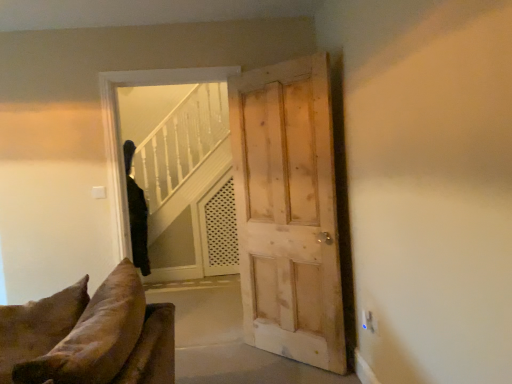
Question: Considering the relative positions of black fabric coat at upper left and transparent glass door at center in the image provided, is black fabric coat at upper left behind transparent glass door at center?

Choices:
 (A) yes
 (B) no

Answer: (A)

Question: Are black fabric coat at upper left and transparent glass door at center far apart?

Choices:
 (A) yes
 (B) no

Answer: (A)

Question: Is black fabric coat at upper left at the left side of transparent glass door at center?

Choices:
 (A) no
 (B) yes

Answer: (B)

Question: From a real-world perspective, is black fabric coat at upper left under transparent glass door at center?

Choices:
 (A) no
 (B) yes

Answer: (B)

Question: Is black fabric coat at upper left with transparent glass door at center?

Choices:
 (A) yes
 (B) no

Answer: (B)

Question: From the image's perspective, is black fabric coat at upper left positioned above or below light brown wooden door at center?

Choices:
 (A) below
 (B) above

Answer: (A)

Question: Is point (143, 236) closer or farther from the camera than point (287, 215)?

Choices:
 (A) closer
 (B) farther

Answer: (B)

Question: Is black fabric coat at upper left inside the boundaries of light brown wooden door at center, or outside?

Choices:
 (A) inside
 (B) outside

Answer: (B)

Question: In the image, is black fabric coat at upper left on the left side or the right side of light brown wooden door at center?

Choices:
 (A) right
 (B) left

Answer: (B)

Question: Considering the positions of black fabric coat at upper left and transparent glass door at center in the image, is black fabric coat at upper left wider or thinner than transparent glass door at center?

Choices:
 (A) wide
 (B) thin

Answer: (A)

Question: From the image's perspective, is black fabric coat at upper left above or below transparent glass door at center?

Choices:
 (A) below
 (B) above

Answer: (A)

Question: Considering the positions of black fabric coat at upper left and transparent glass door at center in the image, is black fabric coat at upper left bigger or smaller than transparent glass door at center?

Choices:
 (A) small
 (B) big

Answer: (A)

Question: Is black fabric coat at upper left inside or outside of transparent glass door at center?

Choices:
 (A) inside
 (B) outside

Answer: (B)

Question: Considering the positions of light brown wooden door at center and transparent glass door at center in the image, is light brown wooden door at center bigger or smaller than transparent glass door at center?

Choices:
 (A) big
 (B) small

Answer: (B)

Question: Relative to transparent glass door at center, is light brown wooden door at center in front or behind?

Choices:
 (A) behind
 (B) front

Answer: (B)